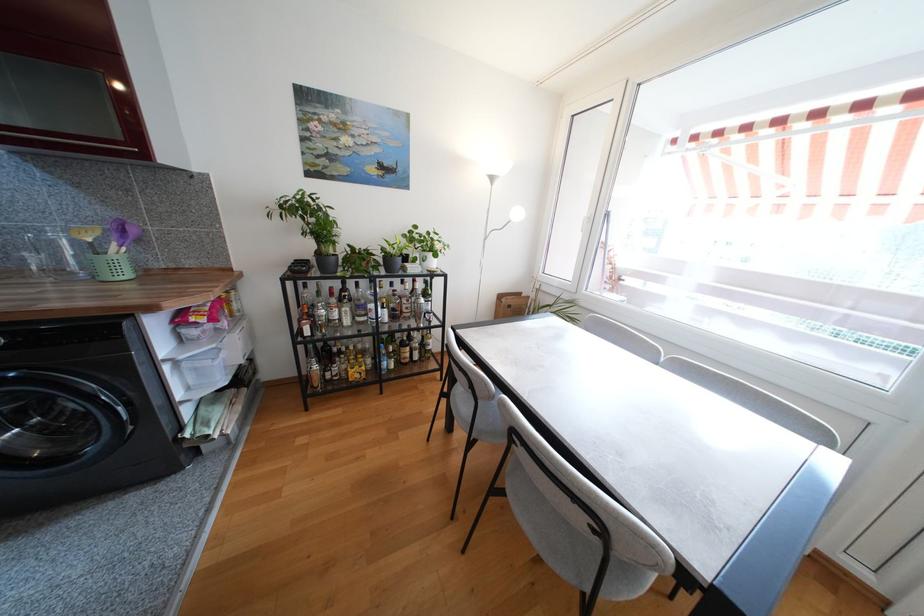
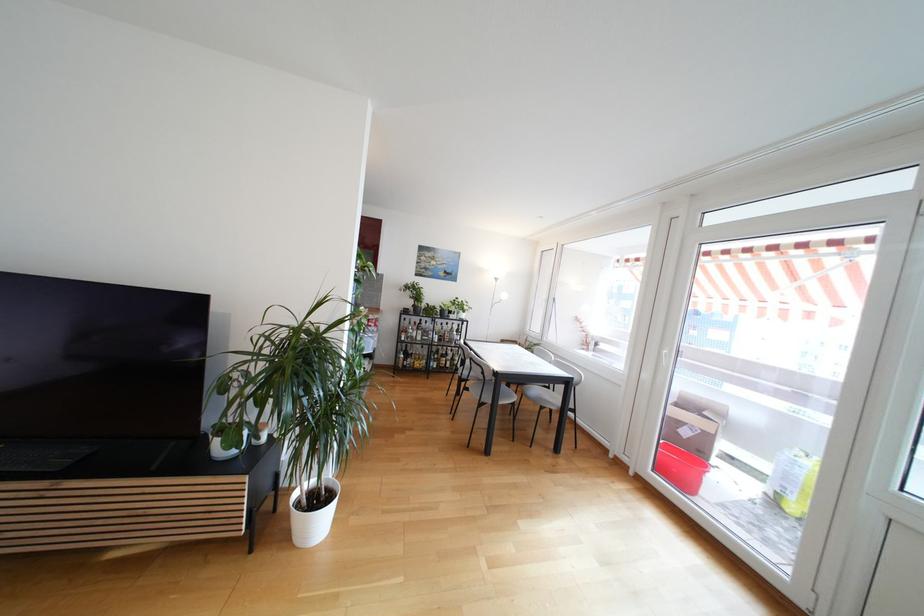
Locate, in the second image, the point that corresponds to the point at 345,322 in the first image.

(419, 339)